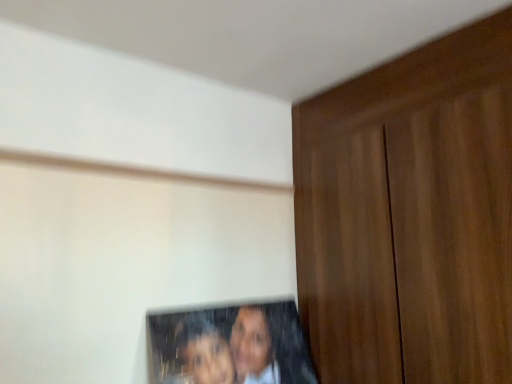
This screenshot has height=384, width=512. Describe the element at coordinates (229, 345) in the screenshot. I see `matte black picture frame at lower center` at that location.

In order to click on matte black picture frame at lower center in this screenshot , I will do `click(229, 345)`.

Find the location of a particular element. The height and width of the screenshot is (384, 512). matte black picture frame at lower center is located at coordinates (229, 345).